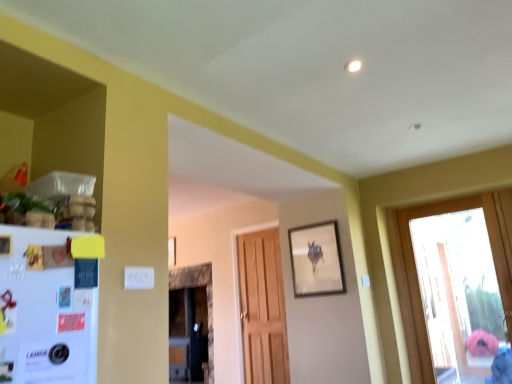
Question: Is matte wooden picture frame at center, which appears as the 1th picture frame when viewed from the back, in front of or behind white matte refrigerator at left in the image?

Choices:
 (A) behind
 (B) front

Answer: (A)

Question: Considering the positions of matte wooden picture frame at center, which ranks as the 2th picture frame in front-to-back order, and white matte refrigerator at left in the image, is matte wooden picture frame at center, which ranks as the 2th picture frame in front-to-back order, taller or shorter than white matte refrigerator at left?

Choices:
 (A) short
 (B) tall

Answer: (A)

Question: Which object is the farthest from the white matte refrigerator at left?

Choices:
 (A) matte wooden picture frame at center, which appears as the 1th picture frame when viewed from the back
 (B) matte wooden picture frame at upper center, which appears as the 1th picture frame when viewed from the right
 (C) transparent glass door at right

Answer: (A)

Question: Based on their relative distances, which object is nearer to the white matte refrigerator at left?

Choices:
 (A) matte wooden picture frame at upper center, the 2th picture frame viewed from the back
 (B) transparent glass door at right
 (C) matte wooden picture frame at center, the second picture frame when ordered from right to left

Answer: (A)